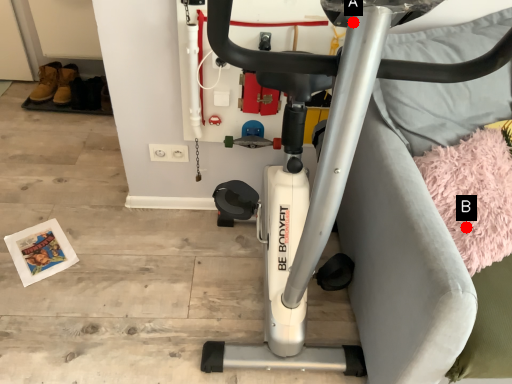
Question: Two points are circled on the image, labeled by A and B beside each circle. Which of the following is the farthest from the observer?

Choices:
 (A) A is further
 (B) B is further

Answer: (B)